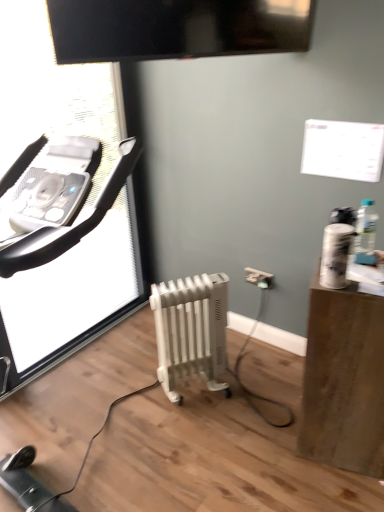
Question: Is transparent plastic screen door at left positioned in front of brown wood side table at right?

Choices:
 (A) no
 (B) yes

Answer: (A)

Question: Is transparent plastic screen door at left turned away from brown wood side table at right?

Choices:
 (A) yes
 (B) no

Answer: (B)

Question: From a real-world perspective, is transparent plastic screen door at left physically above brown wood side table at right?

Choices:
 (A) yes
 (B) no

Answer: (A)

Question: From the image's perspective, would you say transparent plastic screen door at left is positioned over brown wood side table at right?

Choices:
 (A) no
 (B) yes

Answer: (B)

Question: Can you confirm if transparent plastic screen door at left is smaller than brown wood side table at right?

Choices:
 (A) no
 (B) yes

Answer: (A)

Question: Which is correct: glossy black tv at upper center is inside white plastic electric outlet at lower center, or outside of it?

Choices:
 (A) outside
 (B) inside

Answer: (A)

Question: Is point (99, 13) closer or farther from the camera than point (246, 272)?

Choices:
 (A) closer
 (B) farther

Answer: (A)

Question: In terms of size, does glossy black tv at upper center appear bigger or smaller than white plastic electric outlet at lower center?

Choices:
 (A) small
 (B) big

Answer: (B)

Question: In the image, is glossy black tv at upper center positioned in front of or behind white plastic electric outlet at lower center?

Choices:
 (A) behind
 (B) front

Answer: (B)

Question: From a real-world perspective, relative to brown wood side table at right, is glossy black tv at upper center vertically above or below?

Choices:
 (A) below
 (B) above

Answer: (B)

Question: From the image's perspective, is glossy black tv at upper center above or below brown wood side table at right?

Choices:
 (A) below
 (B) above

Answer: (B)

Question: In terms of width, does glossy black tv at upper center look wider or thinner when compared to brown wood side table at right?

Choices:
 (A) wide
 (B) thin

Answer: (B)

Question: Is glossy black tv at upper center inside or outside of brown wood side table at right?

Choices:
 (A) inside
 (B) outside

Answer: (B)

Question: Is transparent plastic screen door at left taller or shorter than white plastic electric outlet at lower center?

Choices:
 (A) tall
 (B) short

Answer: (A)

Question: Is point (89, 89) closer or farther from the camera than point (258, 272)?

Choices:
 (A) closer
 (B) farther

Answer: (B)